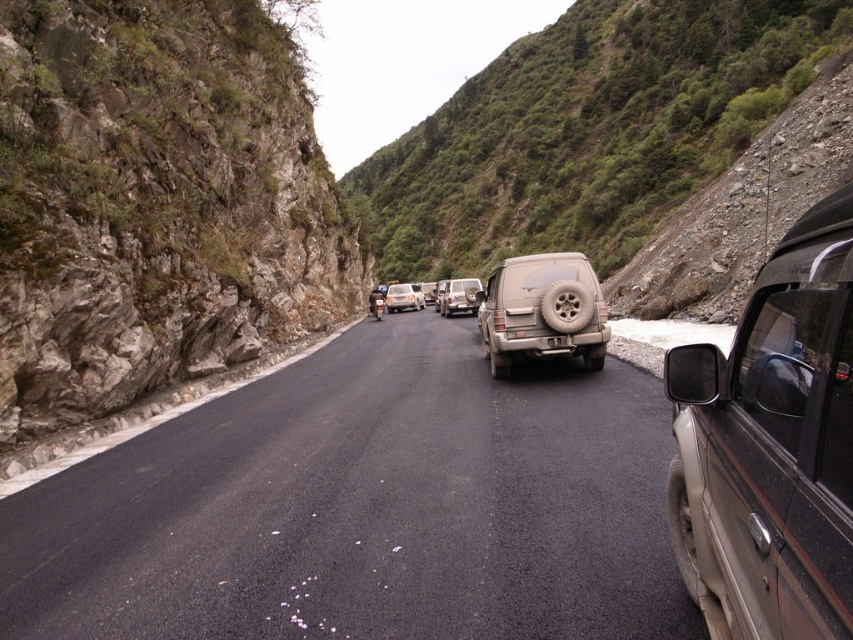
You are driving a car that is 4.5 meters long and want to overtake the metallic silver car at center on this narrow mountain road. Given the road conditions described in the scene, can you safely perform this maneuver?

The distance between you and the metallic silver car at center is 44.95 meters. Since overtaking on a narrow mountain road with steep cliffs and dense vegetation is dangerous, you should not attempt to overtake the metallic silver car at center here.

You are a hiker planning to cross the narrow mountain road. The green leafy hillside at upper center and asphalt road at left are obstacles. Can you safely walk between them?

The green leafy hillside at upper center and asphalt road at left are 358.27 feet apart, so yes, you can safely walk between them as the distance is sufficient for a hiker to pass through.

You are driving a metallic silver car at center and need to park it in a garage that has a height restriction of 1.8 meters. The black plastic license plate at center is exactly at 1.5 meters height. Can your car fit into the garage without hitting the ceiling?

The metallic silver car at center is much taller than the black plastic license plate at center, which is at 1.5 meters. Since the car is significantly taller than 1.5 meters, it may exceed the 1.8 meters height restriction, so there is a risk of hitting the garage ceiling.